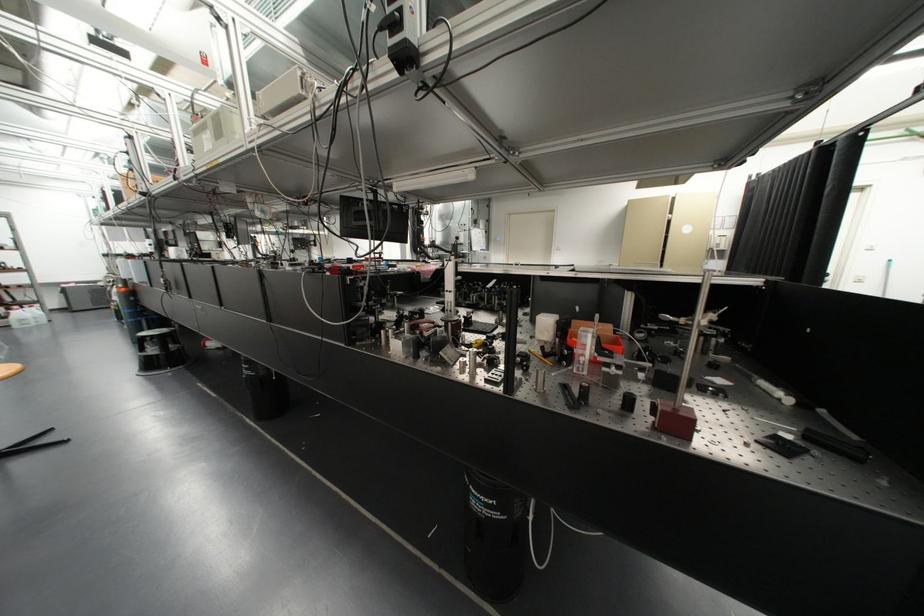
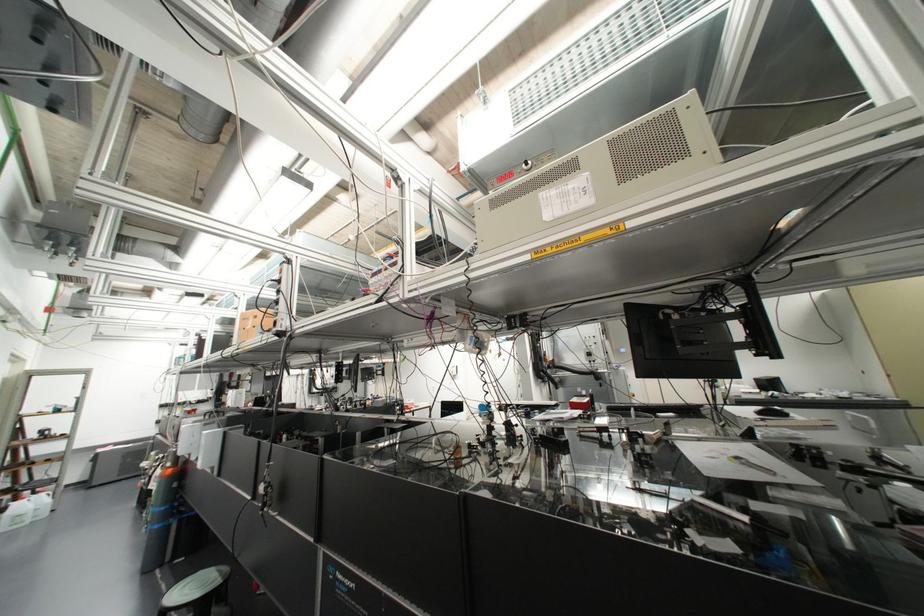
Which direction would the cameraman need to move to produce the second image?

The cameraman moved toward left, forward.